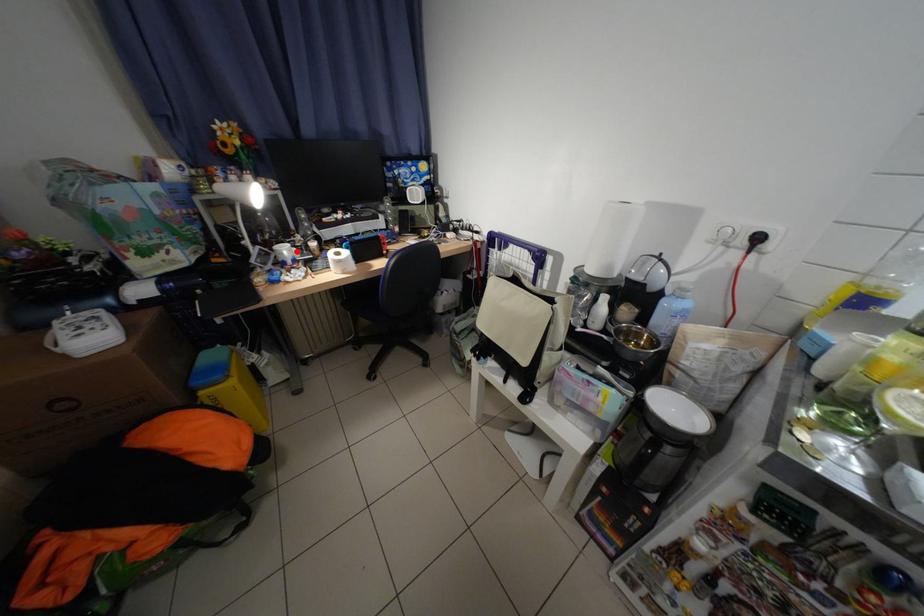
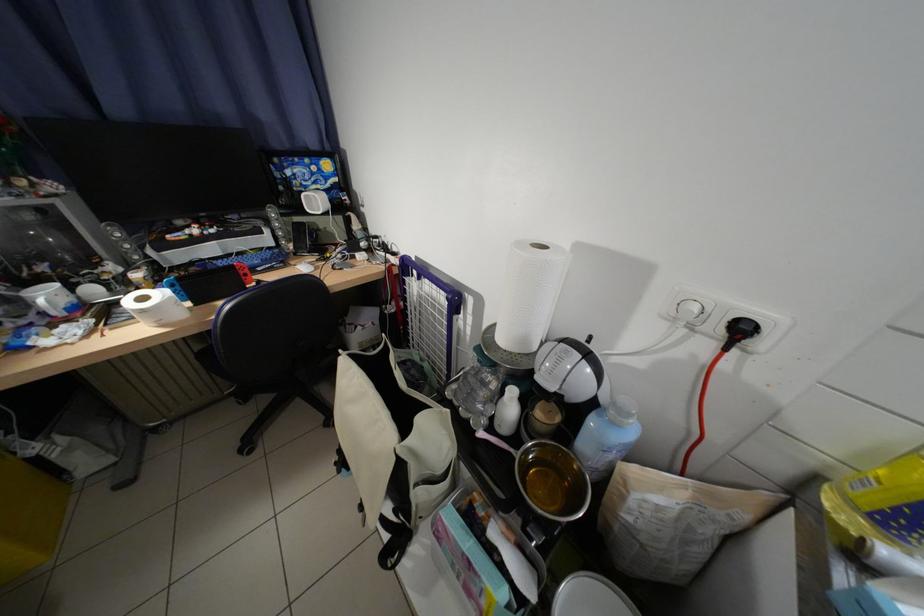
Locate, in the second image, the point that corresponds to the highlighted location in the first image.

(59, 297)